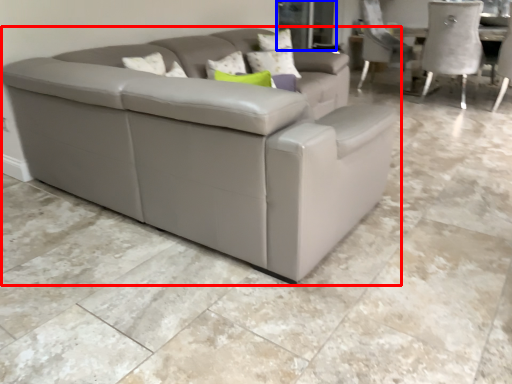
Question: Which object is closer to the camera taking this photo, studio couch (highlighted by a red box) or glass door (highlighted by a blue box)?

Choices:
 (A) studio couch
 (B) glass door

Answer: (A)